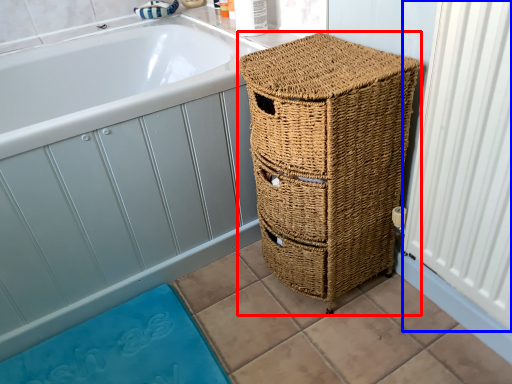
Question: Which object appears closest to the camera in this image, furniture (highlighted by a red box) or radiator (highlighted by a blue box)?

Choices:
 (A) furniture
 (B) radiator

Answer: (B)